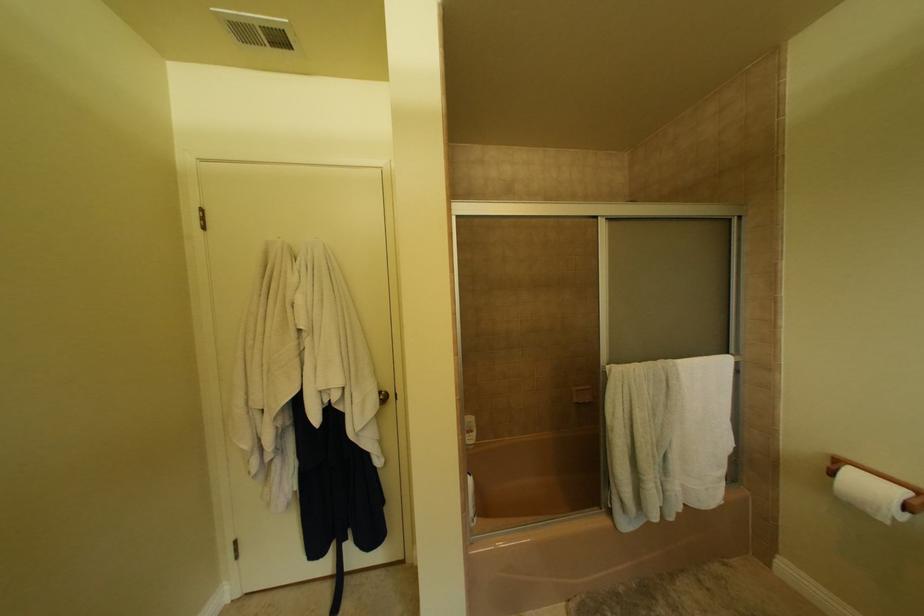
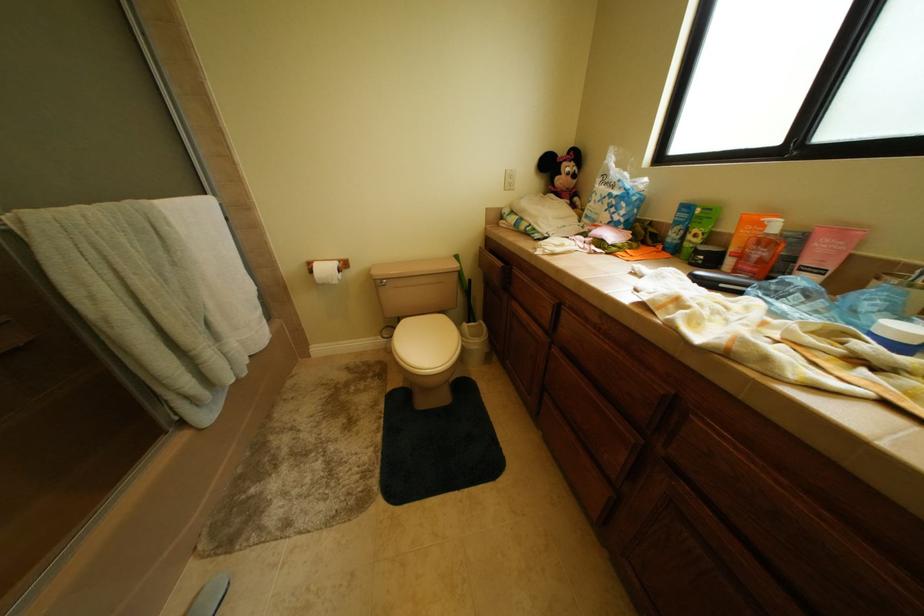
The first image is from the beginning of the video and the second image is from the end. How did the camera likely rotate when shooting the video?

The rotation direction of the camera is right-down.